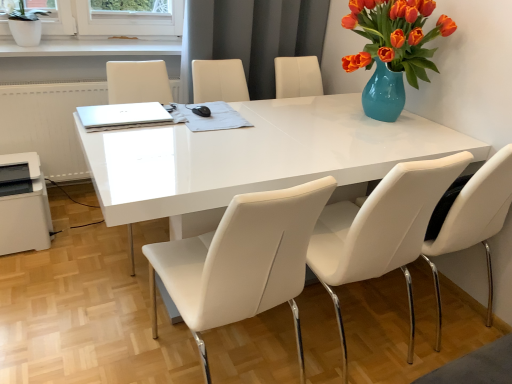
Question: Considering the relative sizes of white leather chair at center, placed as the second chair when sorted from left to right, and white plastic printer at lower left in the image provided, is white leather chair at center, placed as the second chair when sorted from left to right, shorter than white plastic printer at lower left?

Choices:
 (A) no
 (B) yes

Answer: (A)

Question: Is white leather chair at center, placed as the second chair when sorted from left to right, closer to camera compared to white plastic printer at lower left?

Choices:
 (A) yes
 (B) no

Answer: (A)

Question: Does white leather chair at center, placed as the second chair when sorted from left to right, have a larger size compared to white plastic printer at lower left?

Choices:
 (A) no
 (B) yes

Answer: (B)

Question: From a real-world perspective, is white leather chair at center, placed as the second chair when sorted from left to right, physically below white plastic printer at lower left?

Choices:
 (A) no
 (B) yes

Answer: (A)

Question: From the image's perspective, is white leather chair at center, placed as the second chair when sorted from left to right, above white plastic printer at lower left?

Choices:
 (A) yes
 (B) no

Answer: (B)

Question: Is white leather chair at center, arranged as the first chair when viewed from the left, to the left or to the right of white leather chair at center, placed as the second chair when sorted from left to right, in the image?

Choices:
 (A) right
 (B) left

Answer: (B)

Question: Is white leather chair at center, arranged as the first chair when viewed from the left, taller or shorter than white leather chair at center, placed as the 2th chair when sorted from right to left?

Choices:
 (A) tall
 (B) short

Answer: (B)

Question: Considering the positions of point (332, 180) and point (343, 278), is point (332, 180) closer or farther from the camera than point (343, 278)?

Choices:
 (A) closer
 (B) farther

Answer: (A)

Question: Looking at the image, does white leather chair at center, positioned as the 3th chair in right-to-left order, seem bigger or smaller compared to white leather chair at center, placed as the second chair when sorted from left to right?

Choices:
 (A) big
 (B) small

Answer: (A)

Question: From a real-world perspective, is white ceramic pot at upper left physically located above or below white leather chair at center, placed as the second chair when sorted from left to right?

Choices:
 (A) below
 (B) above

Answer: (B)

Question: From the image's perspective, is white ceramic pot at upper left located above or below white leather chair at center, placed as the 2th chair when sorted from right to left?

Choices:
 (A) below
 (B) above

Answer: (B)

Question: Would you say white ceramic pot at upper left is to the left or to the right of white leather chair at center, placed as the 2th chair when sorted from right to left, in the picture?

Choices:
 (A) right
 (B) left

Answer: (B)

Question: Is white ceramic pot at upper left in front of or behind white leather chair at center, placed as the second chair when sorted from left to right, in the image?

Choices:
 (A) behind
 (B) front

Answer: (A)

Question: Visually, is white leather chair at center, placed as the second chair when sorted from left to right, positioned to the left or to the right of silver metallic laptop at upper left?

Choices:
 (A) left
 (B) right

Answer: (B)

Question: From a real-world perspective, is white leather chair at center, placed as the second chair when sorted from left to right, positioned above or below silver metallic laptop at upper left?

Choices:
 (A) above
 (B) below

Answer: (B)